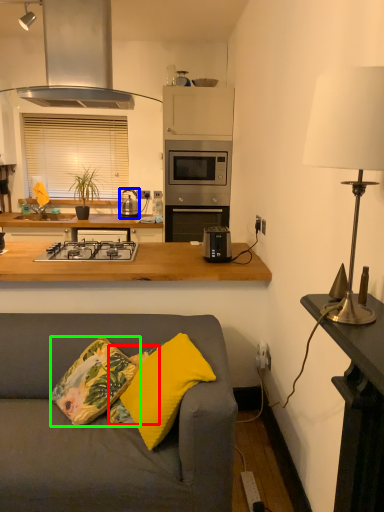
Question: Based on their relative distances, which object is farther from pillow (highlighted by a red box)? Choose from appliance (highlighted by a blue box) and throw pillow (highlighted by a green box).

Choices:
 (A) appliance
 (B) throw pillow

Answer: (A)